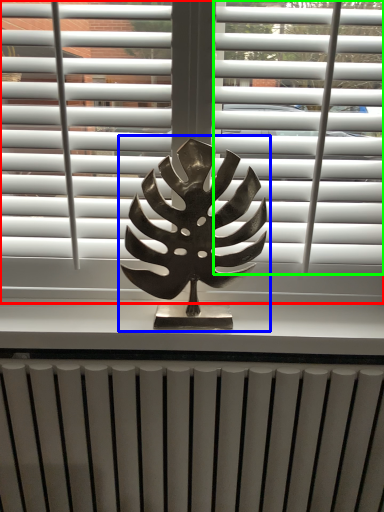
Question: Which object is positioned closest to window blind (highlighted by a red box)? Select from bronze statue (highlighted by a blue box) and blind (highlighted by a green box).

Choices:
 (A) bronze statue
 (B) blind

Answer: (B)